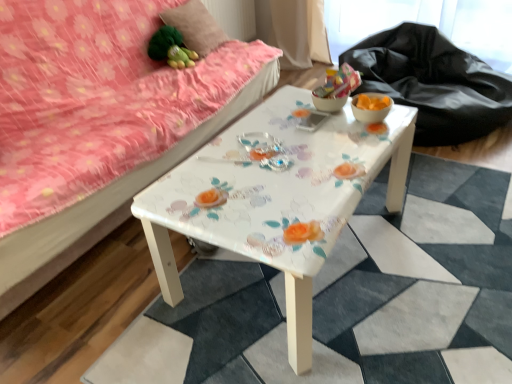
At what (x,y) coordinates should I click in order to perform the action: click on free space in front of translucent glass bowl at center, the 2th glass bowl in the right-to-left sequence. Please return your answer as a coordinate pair (x, y). This screenshot has width=512, height=384. Looking at the image, I should click on (342, 131).